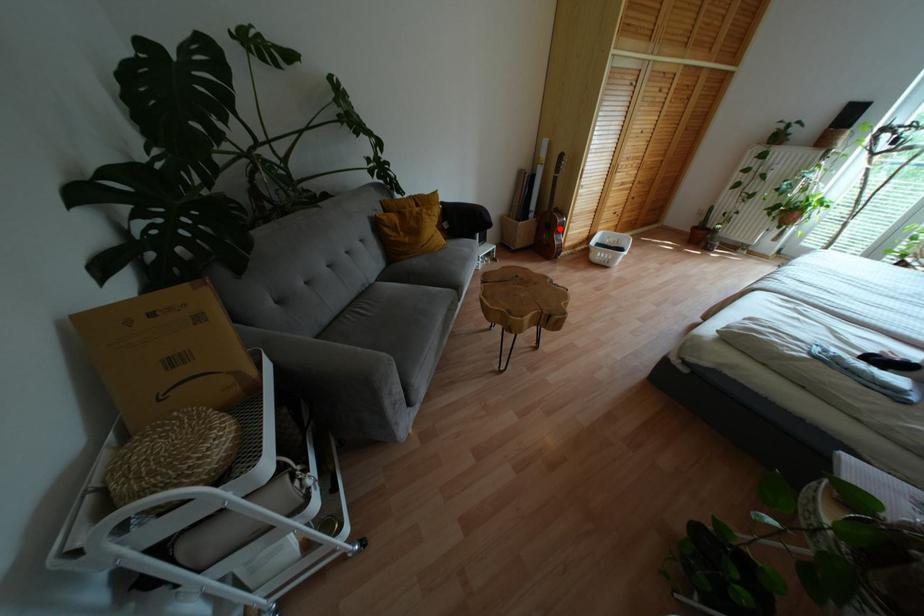
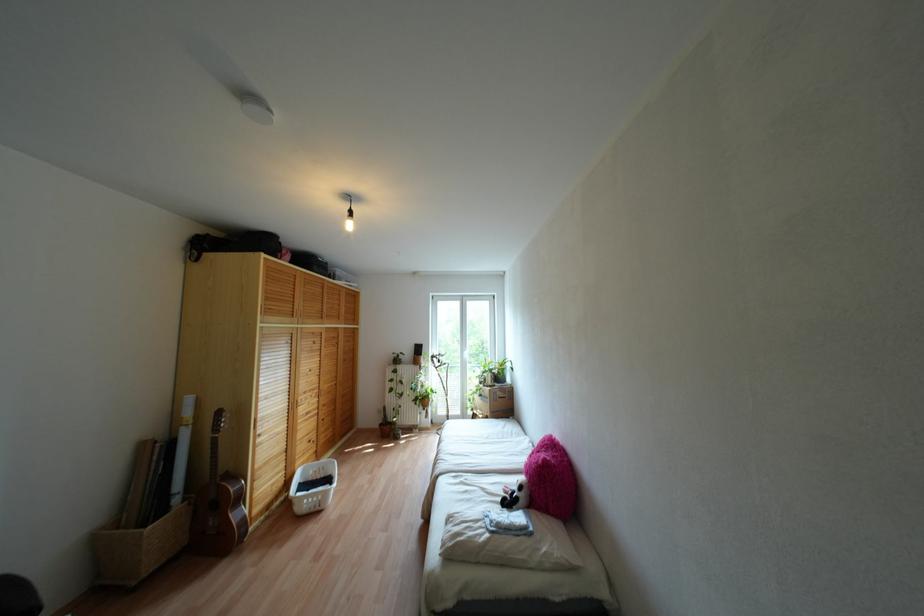
Find the pixel in the second image that matches the highlighted location in the first image.

(238, 498)